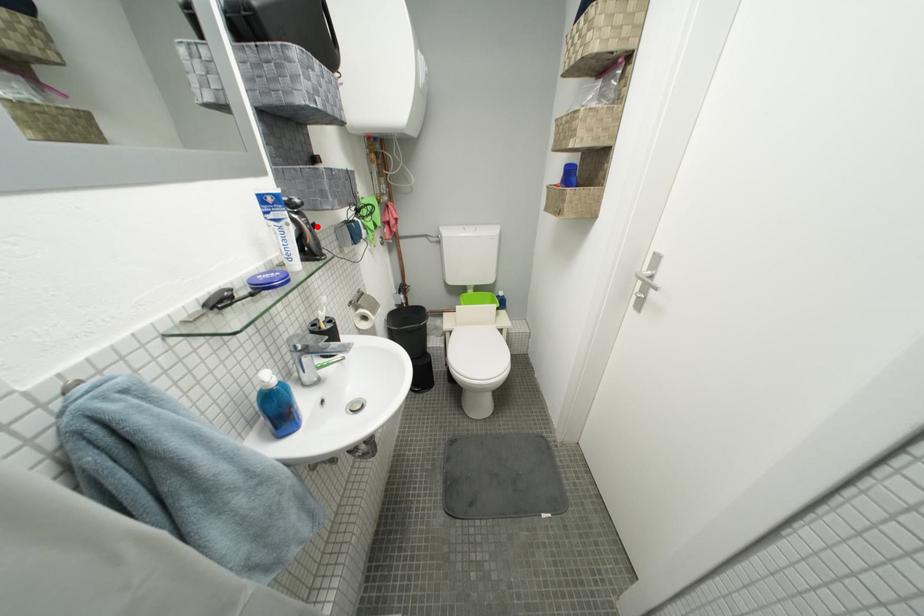
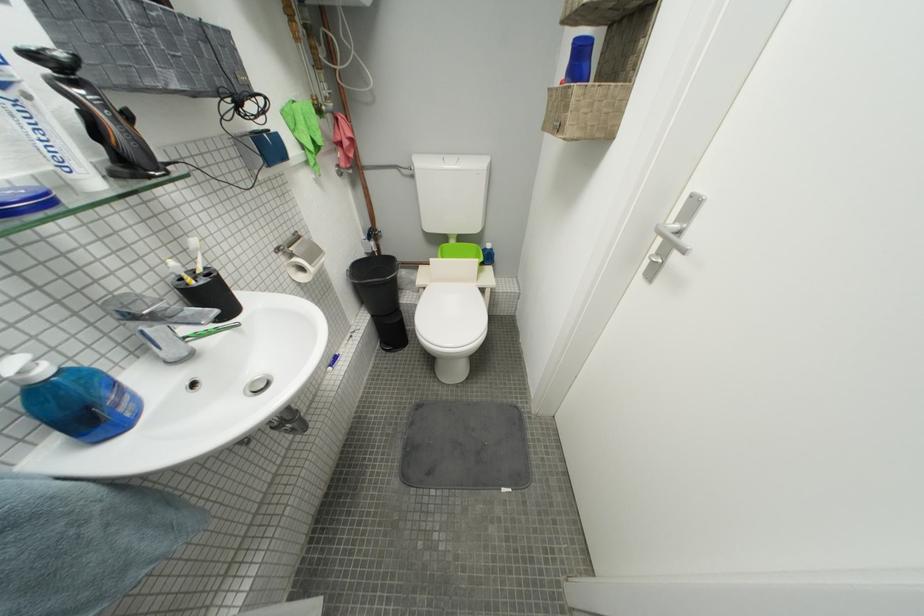
Question: I am providing you with two images of the same scene from different viewpoints. In image1, a red point is highlighted. Considering the same 3D point in image2, which of the following is correct?

Choices:
 (A) It is closer
 (B) It is farther

Answer: (B)